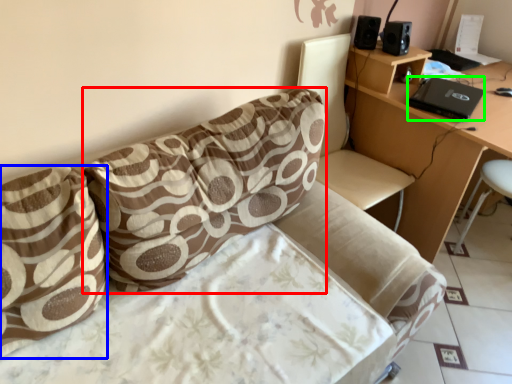
Question: Which object is the farthest from pillow (highlighted by a red box)? Choose among these: pillow (highlighted by a blue box) or laptop (highlighted by a green box).

Choices:
 (A) pillow
 (B) laptop

Answer: (B)